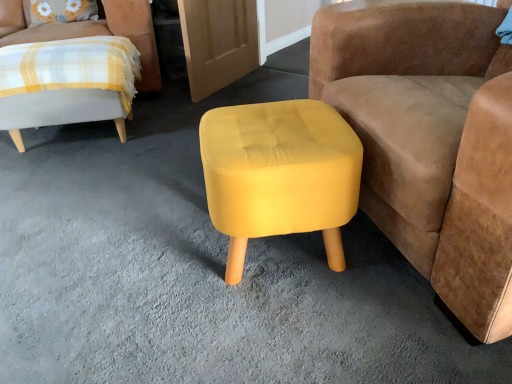
Question: Is velvet mustard stool at center, the second chair in the back-to-front sequence, taller or shorter than plaid fabric chair at left, the 1th chair positioned from the left?

Choices:
 (A) short
 (B) tall

Answer: (B)

Question: Is point (506, 289) positioned closer to the camera than point (152, 54)?

Choices:
 (A) closer
 (B) farther

Answer: (A)

Question: Which object is positioned farthest from the velvety floral pillow at upper left?

Choices:
 (A) yellow fabric stool at center
 (B) velvet mustard stool at center, the second chair in the back-to-front sequence
 (C) plaid fabric chair at left, which ranks as the second chair in front-to-back order

Answer: (B)

Question: Which object is positioned farthest from the velvet mustard stool at center, which is counted as the 2th chair, starting from the left?

Choices:
 (A) yellow fabric stool at center
 (B) plaid fabric chair at left, the 1th chair positioned from the left
 (C) velvety floral pillow at upper left

Answer: (C)